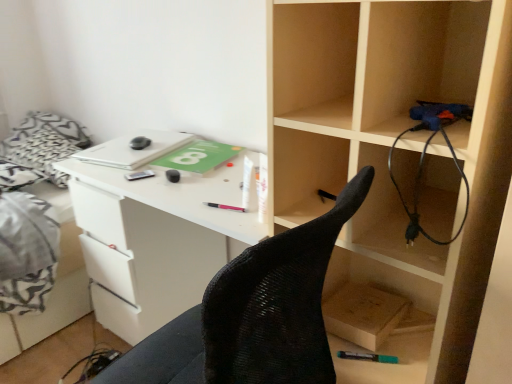
What are the coordinates of `free location in front of black rubber mouse at center, which ranks as the second stationery in back-to-front order` in the screenshot? It's located at (182, 193).